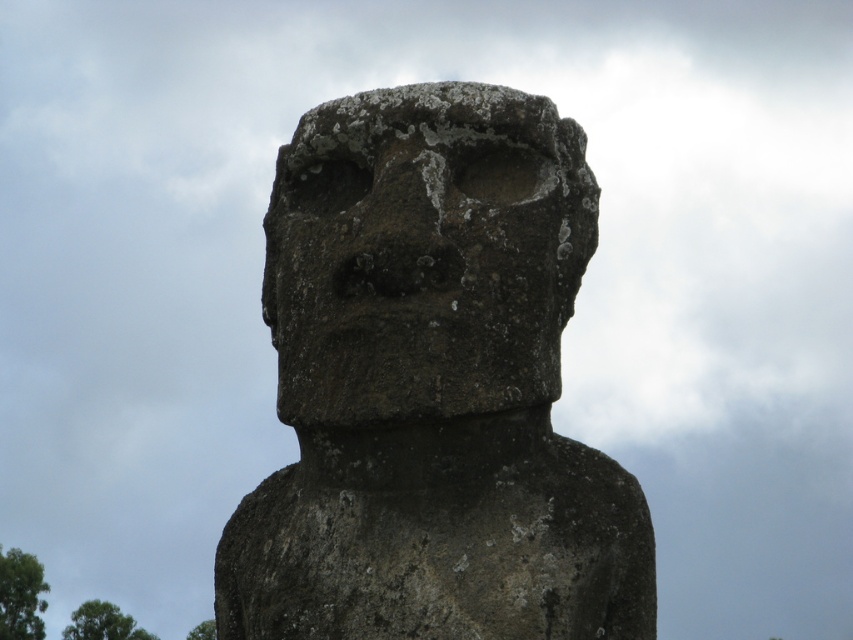
Is rough stone statue at center above rough stone face at center?

Actually, rough stone statue at center is below rough stone face at center.

Between rough stone statue at center and rough stone face at center, which one is positioned higher?

rough stone face at center is above.

Describe the element at coordinates (431, 387) in the screenshot. I see `rough stone statue at center` at that location.

This screenshot has height=640, width=853. I want to click on rough stone statue at center, so click(x=431, y=387).